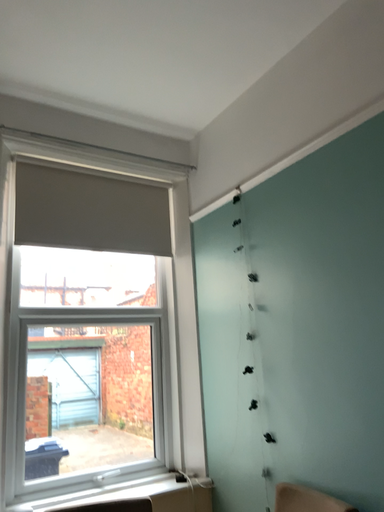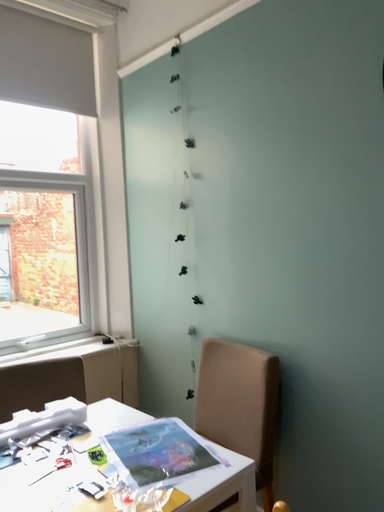
Question: How did the camera likely rotate when shooting the video?

Choices:
 (A) rotated downward
 (B) rotated upward

Answer: (A)